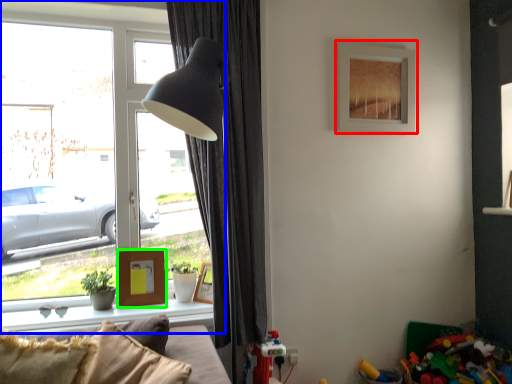
Question: Estimate the real-world distances between objects in this image. Which object is farther from picture frame (highlighted by a red box), window (highlighted by a blue box) or picture frame (highlighted by a green box)?

Choices:
 (A) window
 (B) picture frame

Answer: (B)